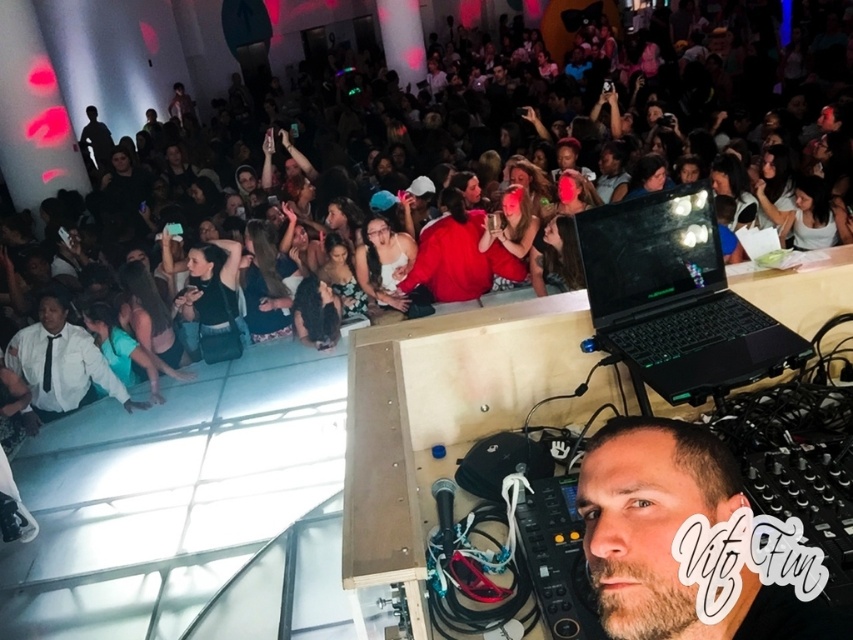
You are at the concert and want to take a photo of the DJ booth. The glossy black laptop at center and the white shirt at lower left are both in your camera frame. Which object will appear smaller in your photo?

The glossy black laptop at center will appear smaller in the photo because it occupies less space than the white shirt at lower left.

You are at the point labeled point (755,625) and want to move to the point labeled point (616,289). Is there a clear path between them?

Yes, there is a clear path between point (755,625) and point (616,289) because the first point is in front of the second point, so there is no obstruction blocking the path between them.